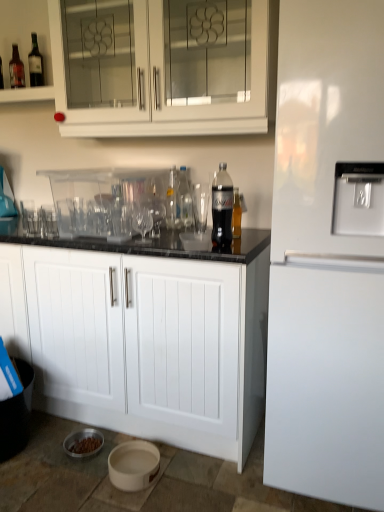
Consider the image. Measure the distance between point (193, 198) and camera.

Point (193, 198) is 1.89 meters from camera.

Identify the location of clear glass shot glass at left, the 1th shot glass positioned from the left. The height and width of the screenshot is (512, 384). (28, 216).

Identify the location of clear plastic drinking straw at upper left, the 1th drinking straw in the back-to-front sequence. (35, 64).

Describe the element at coordinates (49, 222) in the screenshot. I see `transparent glass shot glass at center, arranged as the second shot glass when viewed from the right` at that location.

The height and width of the screenshot is (512, 384). Find the location of `transparent glass shot glass at center, the 2th shot glass in the left-to-right sequence`. transparent glass shot glass at center, the 2th shot glass in the left-to-right sequence is located at coordinates (49, 222).

Locate an element on the screen. The image size is (384, 512). white matte cabinet at center, which appears as the 1th cabinetry when ordered from the bottom is located at coordinates (142, 342).

Identify the location of clear glass wine glass at center, which appears as the first wine glass when viewed from the right. The width and height of the screenshot is (384, 512). (156, 215).

Between point (202, 218) and point (169, 205), which one is positioned behind?

The point (169, 205) is farther from the camera.

Is clear glass shot glass at center, the 3th shot glass viewed from the left, touching clear glass bottle at center, the 2th bottle from the front?

clear glass shot glass at center, the 3th shot glass viewed from the left, and clear glass bottle at center, the 2th bottle from the front, are clearly separated.

From a real-world perspective, which is physically above, clear glass shot glass at center, the 3th shot glass viewed from the left, or clear glass bottle at center, the 2th bottle from the front?

clear glass bottle at center, the 2th bottle from the front.

Which of these two, clear glass shot glass at center, which is counted as the 1th shot glass, starting from the right, or clear glass bottle at center, the 2th bottle from the back, is smaller?

clear glass bottle at center, the 2th bottle from the back.

Is clear plastic drinking straw at upper left, which is the 1th drinking straw from left to right, a part of clear glass bottle at center, the 2th bottle from the front?

No, clear plastic drinking straw at upper left, which is the 1th drinking straw from left to right, is not surrounded by clear glass bottle at center, the 2th bottle from the front.

How distant is clear glass bottle at center, the 2th bottle from the back, from clear plastic drinking straw at upper left, arranged as the 1th drinking straw when viewed from the top?

clear glass bottle at center, the 2th bottle from the back, is 36.42 inches away from clear plastic drinking straw at upper left, arranged as the 1th drinking straw when viewed from the top.

Is clear glass bottle at center, which ranks as the third bottle in right-to-left order, bigger or smaller than clear plastic drinking straw at upper left, the 2th drinking straw when ordered from bottom to top?

Clearly, clear glass bottle at center, which ranks as the third bottle in right-to-left order, is larger in size than clear plastic drinking straw at upper left, the 2th drinking straw when ordered from bottom to top.

Does white matte basin at lower center have a greater width compared to white glossy refrigerator at right?

No, white matte basin at lower center is not wider than white glossy refrigerator at right.

Is white matte basin at lower center facing towards white glossy refrigerator at right?

No, white matte basin at lower center is not turned towards white glossy refrigerator at right.

Measure the distance between white matte basin at lower center and white glossy refrigerator at right.

A distance of 33.02 inches exists between white matte basin at lower center and white glossy refrigerator at right.

Which object is positioned more to the right, white matte basin at lower center or white glossy refrigerator at right?

white glossy refrigerator at right is more to the right.

Is clear plastic drinking straw at upper left, which is counted as the second drinking straw, starting from the right, to the left or to the right of white matte basin at lower center in the image?

clear plastic drinking straw at upper left, which is counted as the second drinking straw, starting from the right, is to the left of white matte basin at lower center.

Can you confirm if clear plastic drinking straw at upper left, the 1th drinking straw in the back-to-front sequence, is wider than white matte basin at lower center?

No, clear plastic drinking straw at upper left, the 1th drinking straw in the back-to-front sequence, is not wider than white matte basin at lower center.

From the image's perspective, which one is positioned lower, clear plastic drinking straw at upper left, the 1th drinking straw in the back-to-front sequence, or white matte basin at lower center?

white matte basin at lower center.

Can you confirm if clear plastic drinking straw at upper left, arranged as the 1th drinking straw when viewed from the top, is bigger than white matte basin at lower center?

Actually, clear plastic drinking straw at upper left, arranged as the 1th drinking straw when viewed from the top, might be smaller than white matte basin at lower center.

From the image's perspective, is clear plastic drinking straw at upper left, the 1th drinking straw in the back-to-front sequence, positioned above or below white glossy refrigerator at right?

clear plastic drinking straw at upper left, the 1th drinking straw in the back-to-front sequence, is situated higher than white glossy refrigerator at right in the image.

Based on their sizes in the image, would you say clear plastic drinking straw at upper left, the 2th drinking straw when ordered from bottom to top, is bigger or smaller than white glossy refrigerator at right?

clear plastic drinking straw at upper left, the 2th drinking straw when ordered from bottom to top, is smaller than white glossy refrigerator at right.

Where is `refrigerator that is on the right side of clear plastic drinking straw at upper left, acting as the 2th drinking straw starting from the front`? This screenshot has height=512, width=384. refrigerator that is on the right side of clear plastic drinking straw at upper left, acting as the 2th drinking straw starting from the front is located at coordinates (328, 256).

Based on the photo, is clear plastic drinking straw at upper left, acting as the 2th drinking straw starting from the front, not close to white glossy refrigerator at right?

Indeed, clear plastic drinking straw at upper left, acting as the 2th drinking straw starting from the front, is not near white glossy refrigerator at right.

From a real-world perspective, is transparent glass wine glass at center, the 2th wine glass viewed from the right, below transparent plastic drinking straw at center, which is the 2th drinking straw in left-to-right order?

Yes, from a real-world perspective, transparent glass wine glass at center, the 2th wine glass viewed from the right, is below transparent plastic drinking straw at center, which is the 2th drinking straw in left-to-right order.

Can you tell me how much transparent glass wine glass at center, the 2th wine glass viewed from the right, and transparent plastic drinking straw at center, which is the 1th drinking straw in front-to-back order, differ in facing direction?

0.00666 degrees separate the facing orientations of transparent glass wine glass at center, the 2th wine glass viewed from the right, and transparent plastic drinking straw at center, which is the 1th drinking straw in front-to-back order.

Which wine glass is the 2nd one when counting from the left side of the transparent plastic drinking straw at center, marked as the first drinking straw in a bottom-to-top arrangement? Please provide its 2D coordinates.

[(142, 220)]

Is transparent glass wine glass at center, the 1th wine glass in the left-to-right sequence, at the left side of transparent plastic drinking straw at center, the 1th drinking straw positioned from the right?

Correct, you'll find transparent glass wine glass at center, the 1th wine glass in the left-to-right sequence, to the left of transparent plastic drinking straw at center, the 1th drinking straw positioned from the right.

From the picture: Which of these two, white glass cabinet at upper center, the first cabinetry when ordered from top to bottom, or translucent plastic bottle at center, which is counted as the third bottle, starting from the left, is thinner?

Thinner between the two is translucent plastic bottle at center, which is counted as the third bottle, starting from the left.

Considering the sizes of objects white glass cabinet at upper center, the first cabinetry when ordered from top to bottom, and translucent plastic bottle at center, which is counted as the third bottle, starting from the left, in the image provided, who is smaller, white glass cabinet at upper center, the first cabinetry when ordered from top to bottom, or translucent plastic bottle at center, which is counted as the third bottle, starting from the left,?

With smaller size is translucent plastic bottle at center, which is counted as the third bottle, starting from the left.

Is white glass cabinet at upper center, the second cabinetry in the bottom-to-top sequence, oriented towards translucent plastic bottle at center, the 1th bottle viewed from the front?

No, white glass cabinet at upper center, the second cabinetry in the bottom-to-top sequence, is not facing towards translucent plastic bottle at center, the 1th bottle viewed from the front.

Which point is more distant from viewer, (160, 123) or (236, 200)?

The point (160, 123) is farther from the camera.

You are a GUI agent. You are given a task and a screenshot of the screen. Output one action in this format:
    pyautogui.click(x=<x>, y=<y>)
    Task: Click on the bottle that is the 2nd object to the left of the clear glass shot glass at center, which is counted as the 1th shot glass, starting from the right, starting at the anchor
    This screenshot has height=512, width=384.
    Given the screenshot: What is the action you would take?
    pyautogui.click(x=172, y=200)

Locate an element on the screen. The width and height of the screenshot is (384, 512). the 2nd bottle in front of the clear plastic drinking straw at upper left, the 1th drinking straw in the back-to-front sequence, counting from the anchor's position is located at coordinates (172, 200).

When comparing their distances from translucent plastic bottle at center, arranged as the third bottle when viewed from the back, does transparent glass wine glass at center, the 2th wine glass viewed from the right, or transparent plastic drinking straw at center, which is the 1th drinking straw in front-to-back order, seem further?

transparent glass wine glass at center, the 2th wine glass viewed from the right, is further to translucent plastic bottle at center, arranged as the third bottle when viewed from the back.

Estimate the real-world distances between objects in this image. Which object is closer to transparent glass shot glass at center, arranged as the second shot glass when viewed from the right, transparent plastic bottle at center, the 2th bottle positioned from the left, or white glossy refrigerator at right?

The object closer to transparent glass shot glass at center, arranged as the second shot glass when viewed from the right, is transparent plastic bottle at center, the 2th bottle positioned from the left.

Based on their spatial positions, is white matte basin at lower center or transparent plastic bottle at center, the 2th bottle in the right-to-left sequence, closer to clear plastic drinking straw at upper left, which is counted as the second drinking straw, starting from the right?

The object closer to clear plastic drinking straw at upper left, which is counted as the second drinking straw, starting from the right, is transparent plastic bottle at center, the 2th bottle in the right-to-left sequence.

From the image, which object appears to be nearer to white glass cabinet at upper center, the first cabinetry when ordered from top to bottom, clear glass shot glass at left, the 1th shot glass positioned from the left, or clear glass shot glass at center, which is counted as the 1th shot glass, starting from the right?

clear glass shot glass at center, which is counted as the 1th shot glass, starting from the right, lies closer to white glass cabinet at upper center, the first cabinetry when ordered from top to bottom, than the other object.

Considering their positions, is transparent plastic bottle at center, the first bottle positioned from the back, positioned further to white glossy refrigerator at right than clear glass bottle at center, the 1th bottle when ordered from left to right?

clear glass bottle at center, the 1th bottle when ordered from left to right, is positioned further to the anchor white glossy refrigerator at right.

When comparing their distances from clear glass shot glass at center, which is counted as the 1th shot glass, starting from the right, does translucent plastic bottle at center, the 1th bottle viewed from the front, or clear glass bottle at center, the 1th bottle when ordered from left to right, seem further?

translucent plastic bottle at center, the 1th bottle viewed from the front, lies further to clear glass shot glass at center, which is counted as the 1th shot glass, starting from the right, than the other object.

Which object lies further to the anchor point white matte basin at lower center, clear glass shot glass at center, the 3th shot glass viewed from the left, or clear plastic drinking straw at upper left, which is counted as the second drinking straw, starting from the right?

clear plastic drinking straw at upper left, which is counted as the second drinking straw, starting from the right.

Which object lies nearer to the anchor point clear glass bottle at center, the 1th bottle when ordered from left to right, white matte basin at lower center or transparent plastic bottle at center, the first bottle positioned from the back?

transparent plastic bottle at center, the first bottle positioned from the back, is positioned closer to the anchor clear glass bottle at center, the 1th bottle when ordered from left to right.

In order to click on bottle that lies between clear glass shot glass at center, which is counted as the 1th shot glass, starting from the right, and white matte basin at lower center from top to bottom in this screenshot , I will do `click(236, 215)`.

Identify the location of cabinetry between clear plastic drinking straw at upper left, the 2th drinking straw when ordered from bottom to top, and transparent glass wine glass at center, the 2th wine glass viewed from the right, in the up-down direction. This screenshot has width=384, height=512. (164, 87).

The image size is (384, 512). I want to click on shot glass located between clear glass shot glass at left, the 1th shot glass positioned from the left, and transparent glass wine glass at center, the 1th wine glass in the left-to-right sequence, in the left-right direction, so click(x=49, y=222).

Find the location of a particular element. shot glass between clear glass bottle at center, the 1th bottle when ordered from left to right, and translucent plastic bottle at center, which is counted as the first bottle, starting from the right, from left to right is located at coordinates (200, 206).